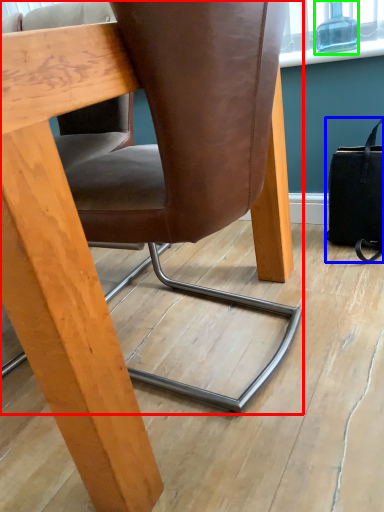
Question: Which object is the farthest from chair (highlighted by a red box)? Choose among these: handbag (highlighted by a blue box) or bottle (highlighted by a green box).

Choices:
 (A) handbag
 (B) bottle

Answer: (B)